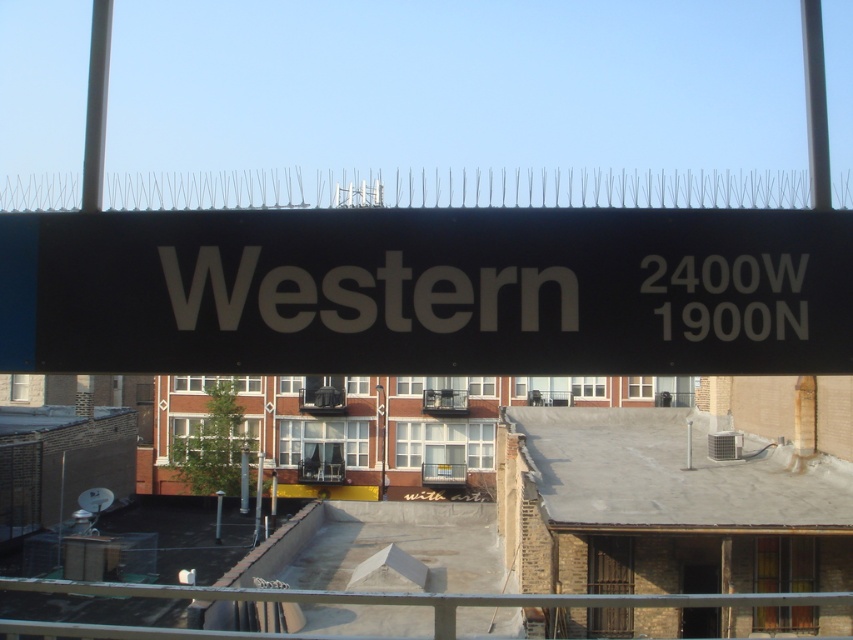
Is black matte sign at upper center bigger than metallic gray rail at lower center?

Incorrect, black matte sign at upper center is not larger than metallic gray rail at lower center.

Does black matte sign at upper center come in front of metallic gray rail at lower center?

Yes, black matte sign at upper center is in front of metallic gray rail at lower center.

Locate an element on the screen. black matte sign at upper center is located at coordinates (428, 291).

Identify the location of black matte sign at upper center. This screenshot has width=853, height=640. (428, 291).

Which is above, black matte sign at upper center or metallic pole at upper left?

metallic pole at upper left is above.

Can you confirm if black matte sign at upper center is positioned to the right of metallic pole at upper left?

Correct, you'll find black matte sign at upper center to the right of metallic pole at upper left.

Which is behind, point (550, 225) or point (86, 109)?

Positioned behind is point (86, 109).

Find the location of a particular element. This screenshot has height=640, width=853. black matte sign at upper center is located at coordinates (428, 291).

Is metallic gray rail at lower center wider than metallic pole at upper left?

Yes, metallic gray rail at lower center is wider than metallic pole at upper left.

At what (x,y) coordinates should I click in order to perform the action: click on metallic gray rail at lower center. Please return your answer as a coordinate pair (x, y). Looking at the image, I should click on (433, 596).